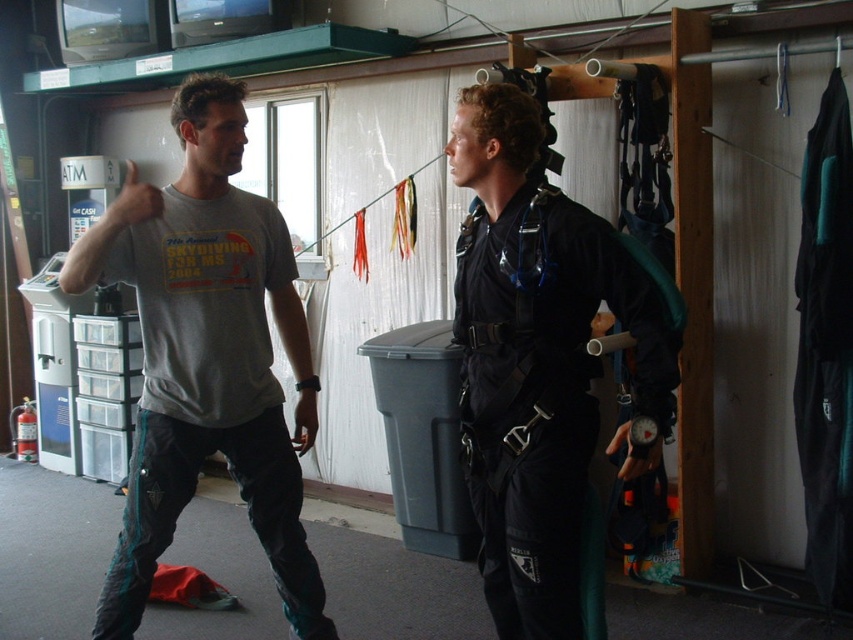
Question: Does black matte diving suit at center appear over gray cotton t-shirt at upper left?

Choices:
 (A) yes
 (B) no

Answer: (A)

Question: Which of the following is the farthest from the observer?

Choices:
 (A) (666, 332)
 (B) (216, 211)

Answer: (B)

Question: Does black matte diving suit at center appear on the left side of gray cotton t-shirt at upper left?

Choices:
 (A) yes
 (B) no

Answer: (B)

Question: Can you confirm if black matte diving suit at center is positioned to the right of gray cotton t-shirt at upper left?

Choices:
 (A) yes
 (B) no

Answer: (A)